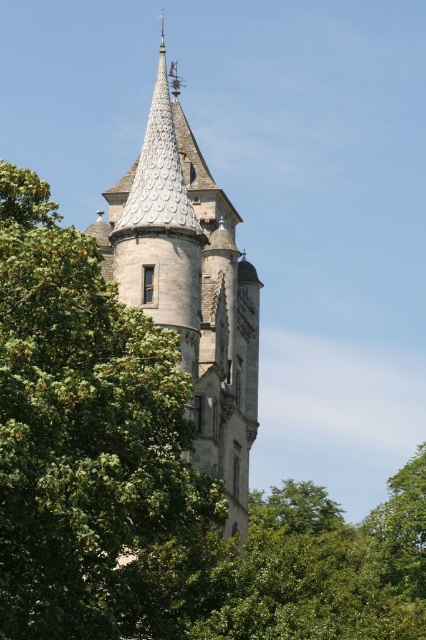
Is green leafy tree at center smaller than stone steeple at center?

Yes.

Does green leafy tree at center have a larger size compared to stone steeple at center?

No.

Is point (31, 529) more distant than point (132, 182)?

No, (31, 529) is closer to viewer.

This screenshot has width=426, height=640. Find the location of `green leafy tree at center`. green leafy tree at center is located at coordinates (92, 448).